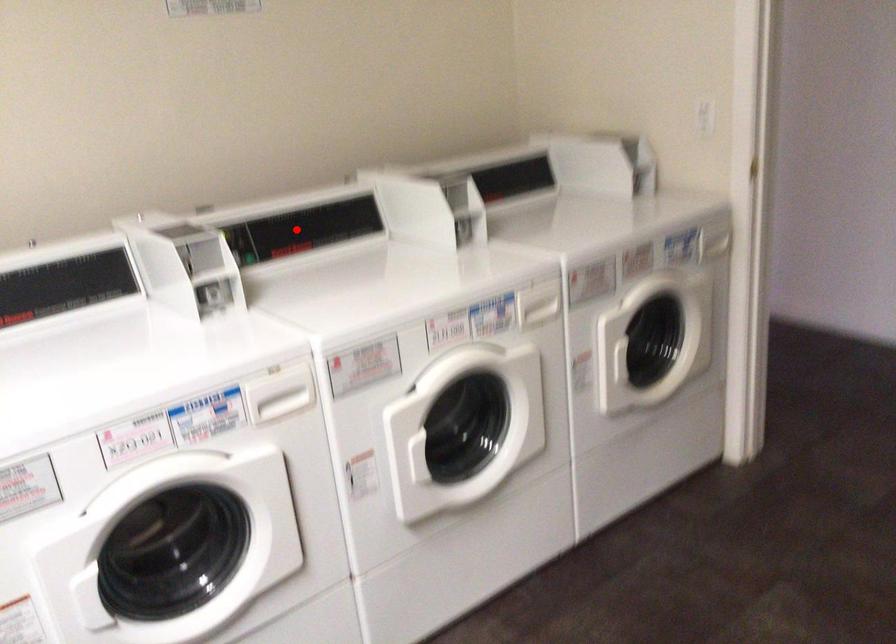
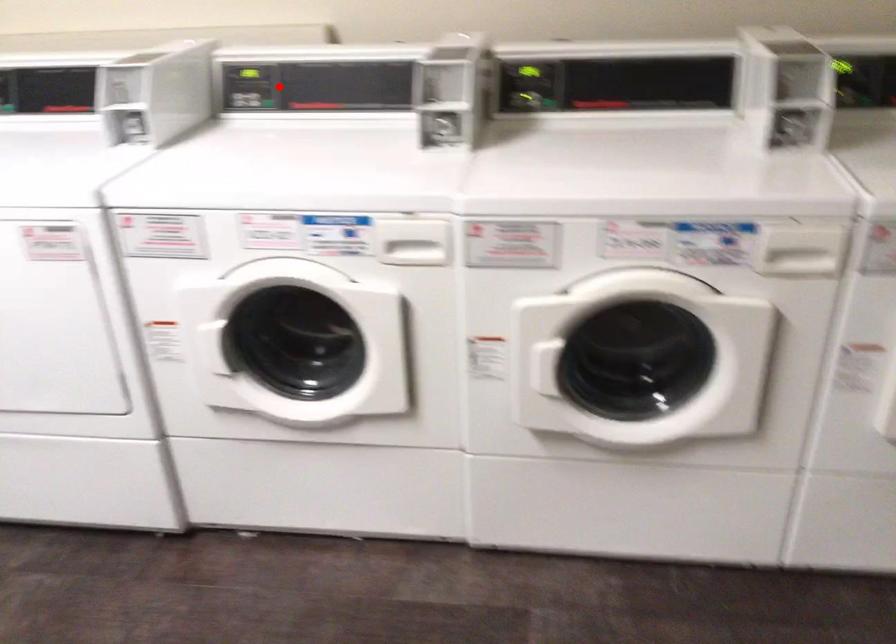
I am providing you with two images of the same scene from different viewpoints. A red point is marked on the first image and another point is marked on the second image. Is the marked point in image1 the same physical position as the marked point in image2?

No